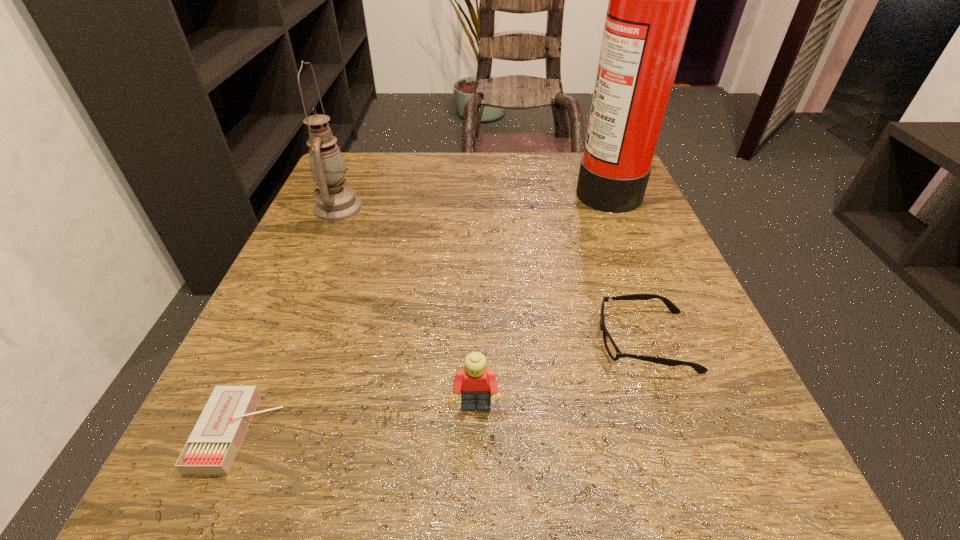
Where is `free space between the spectacles and the fourth shortest object`? The width and height of the screenshot is (960, 540). free space between the spectacles and the fourth shortest object is located at coordinates (492, 274).

Locate an element on the screen. object that is the third closest one to the fourth shortest object is located at coordinates (651, 0).

At what (x,y) coordinates should I click in order to perform the action: click on the third closest object relative to the spectacles. Please return your answer as a coordinate pair (x, y). This screenshot has height=540, width=960. Looking at the image, I should click on (211, 448).

The height and width of the screenshot is (540, 960). I want to click on free spot that satisfies the following two spatial constraints: 1. on the front-facing side of the tallest object; 2. on the face of the Lego, so [696, 407].

Identify the location of vacant point that satisfies the following two spatial constraints: 1. on the front-facing side of the tallest object; 2. on the face of the third object from left to right. This screenshot has height=540, width=960. (696, 407).

The width and height of the screenshot is (960, 540). What are the coordinates of `free space that satisfies the following two spatial constraints: 1. on the face of the Lego; 2. on the striking surface of the shortest object` in the screenshot? It's located at (476, 433).

I want to click on vacant space that satisfies the following two spatial constraints: 1. on the front-facing side of the fire extinguisher; 2. on the face of the third tallest object, so click(x=696, y=407).

Locate an element on the screen. The image size is (960, 540). vacant space that satisfies the following two spatial constraints: 1. on the face of the Lego; 2. on the striking surface of the matchbox is located at coordinates (476, 433).

Where is `free spot that satisfies the following two spatial constraints: 1. on the front-facing side of the fire extinguisher; 2. on the face of the Lego`? Image resolution: width=960 pixels, height=540 pixels. free spot that satisfies the following two spatial constraints: 1. on the front-facing side of the fire extinguisher; 2. on the face of the Lego is located at coordinates (696, 407).